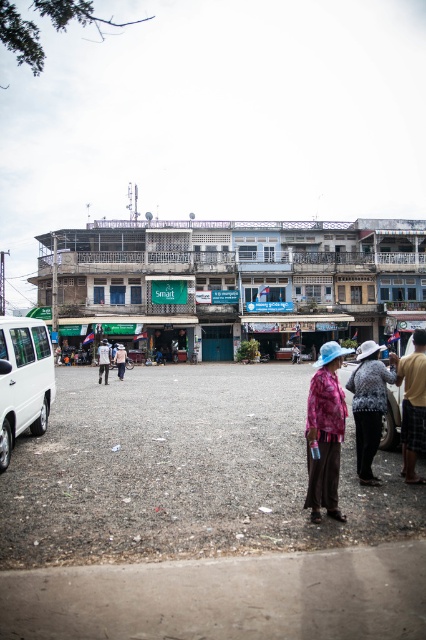
Question: Observing the image, what is the correct spatial positioning of white cotton shirt at center in reference to light pink fabric hat at center?

Choices:
 (A) below
 (B) above

Answer: (A)

Question: Does brown wooden market at center have a greater width compared to white matte van at lower left?

Choices:
 (A) yes
 (B) no

Answer: (A)

Question: Which point is closer to the camera taking this photo?

Choices:
 (A) (146, 529)
 (B) (118, 358)

Answer: (A)

Question: Is brown wooden market at center in front of pink fabric hat at center?

Choices:
 (A) yes
 (B) no

Answer: (B)

Question: Among these points, which one is nearest to the camera?

Choices:
 (A) (120, 352)
 (B) (271, 374)
 (C) (290, 349)

Answer: (A)

Question: Estimate the real-world distances between objects in this image. Which object is closer to the white cotton shirt at center?

Choices:
 (A) white matte van at lower left
 (B) printed fabric pants at center
 (C) brown wooden market at center
 (D) brown gravel dirt field at center

Answer: (D)